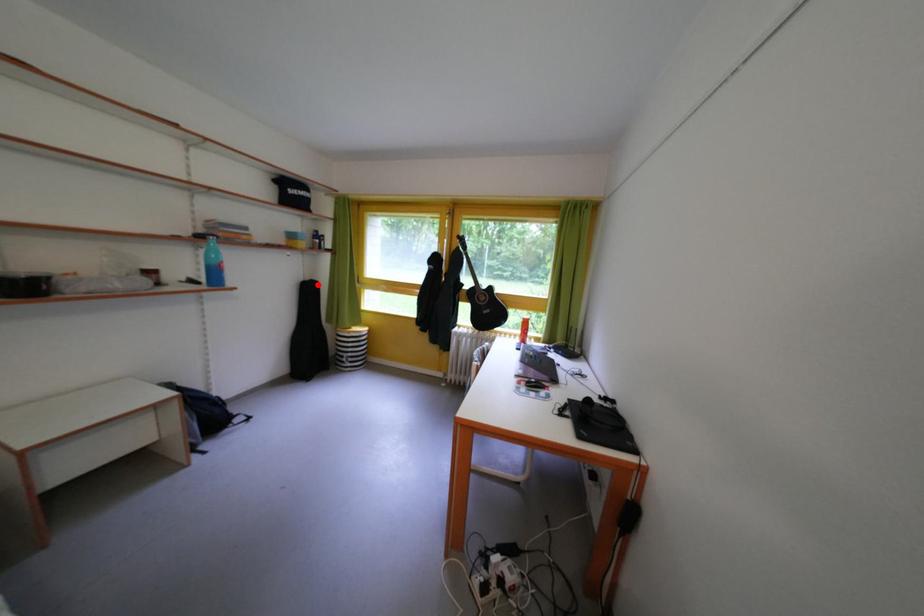
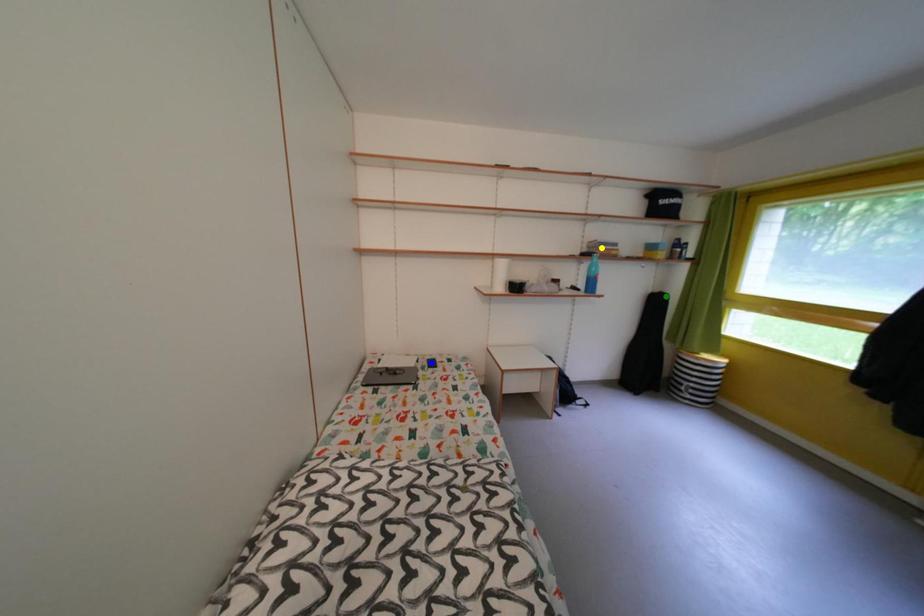
Question: I am providing you with two images of the same scene from different viewpoints. A red point is marked on the first image. You are given multiple points on the second image. Which mark in image 2 goes with the point in image 1?

Choices:
 (A) green point
 (B) blue point
 (C) yellow point

Answer: (A)